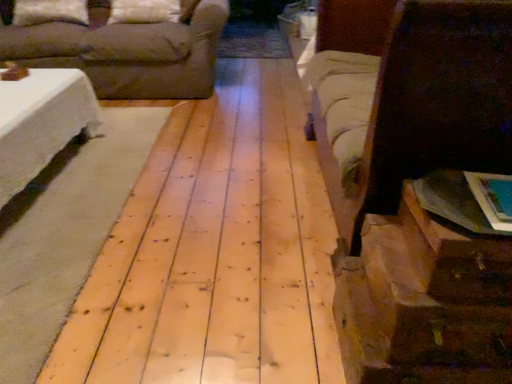
Question: From the image's perspective, would you say white fabric pillow at upper center, the 2th pillow positioned from the left, is positioned over brown fabric bed at right?

Choices:
 (A) no
 (B) yes

Answer: (B)

Question: Considering the relative sizes of white fabric pillow at upper center, arranged as the 1th pillow when viewed from the right, and brown fabric bed at right in the image provided, is white fabric pillow at upper center, arranged as the 1th pillow when viewed from the right, shorter than brown fabric bed at right?

Choices:
 (A) yes
 (B) no

Answer: (A)

Question: Does white fabric pillow at upper center, the 2th pillow positioned from the left, have a greater height compared to brown fabric bed at right?

Choices:
 (A) yes
 (B) no

Answer: (B)

Question: Is white fabric pillow at upper center, the 2th pillow positioned from the left, directly adjacent to brown fabric bed at right?

Choices:
 (A) no
 (B) yes

Answer: (A)

Question: From a real-world perspective, is white fabric pillow at upper center, arranged as the 1th pillow when viewed from the right, on brown fabric bed at right?

Choices:
 (A) yes
 (B) no

Answer: (A)

Question: From the image's perspective, is brown fabric couch at upper left located above or below natural wood floor at center?

Choices:
 (A) above
 (B) below

Answer: (A)

Question: Is brown fabric couch at upper left wider or thinner than natural wood floor at center?

Choices:
 (A) wide
 (B) thin

Answer: (B)

Question: In the image, is brown fabric couch at upper left on the left side or the right side of natural wood floor at center?

Choices:
 (A) right
 (B) left

Answer: (B)

Question: Do you think brown fabric couch at upper left is within natural wood floor at center, or outside of it?

Choices:
 (A) inside
 (B) outside

Answer: (B)

Question: In terms of height, does natural wood floor at center look taller or shorter compared to brown paper bag at lower right?

Choices:
 (A) tall
 (B) short

Answer: (B)

Question: Would you say natural wood floor at center is inside or outside brown paper bag at lower right?

Choices:
 (A) outside
 (B) inside

Answer: (A)

Question: In terms of size, does natural wood floor at center appear bigger or smaller than brown paper bag at lower right?

Choices:
 (A) small
 (B) big

Answer: (B)

Question: In the image, is natural wood floor at center positioned in front of or behind brown paper bag at lower right?

Choices:
 (A) behind
 (B) front

Answer: (A)

Question: In terms of height, does white soft pillow at upper left, which is the 1th pillow from left to right, look taller or shorter compared to white fabric pillow at upper center, arranged as the 1th pillow when viewed from the right?

Choices:
 (A) tall
 (B) short

Answer: (B)

Question: Based on their positions, is white soft pillow at upper left, which is the 1th pillow from left to right, located to the left or right of white fabric pillow at upper center, arranged as the 1th pillow when viewed from the right?

Choices:
 (A) right
 (B) left

Answer: (B)